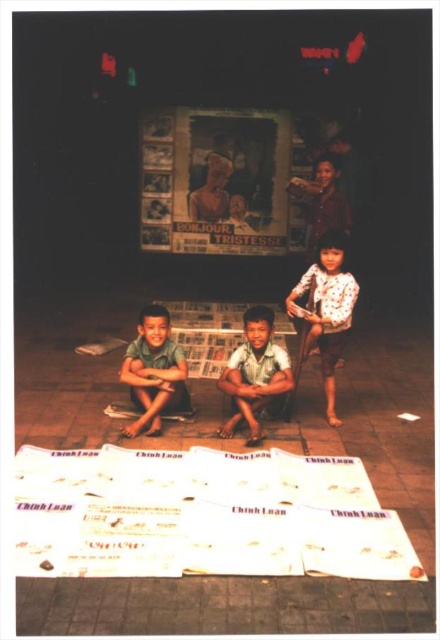
Can you confirm if white cotton shirt at right is taller than light brown fabric boy at center?

Correct, white cotton shirt at right is much taller as light brown fabric boy at center.

Locate an element on the screen. white cotton shirt at right is located at coordinates (326, 310).

Which is more to the right, matte paper poster at upper center or light brown fabric boy at center?

From the viewer's perspective, light brown fabric boy at center appears more on the right side.

Between point (285, 216) and point (248, 404), which one is positioned behind?

Point (285, 216)

Is point (285, 195) closer to viewer compared to point (290, 369)?

No, (285, 195) is behind (290, 369).

At what (x,y) coordinates should I click in order to perform the action: click on matte paper poster at upper center. Please return your answer as a coordinate pair (x, y). This screenshot has width=440, height=640. Looking at the image, I should click on (215, 180).

Which is above, white cotton shirt at right or matte green shorts at center?

Positioned higher is white cotton shirt at right.

Where is `white cotton shirt at right`? This screenshot has width=440, height=640. white cotton shirt at right is located at coordinates (326, 310).